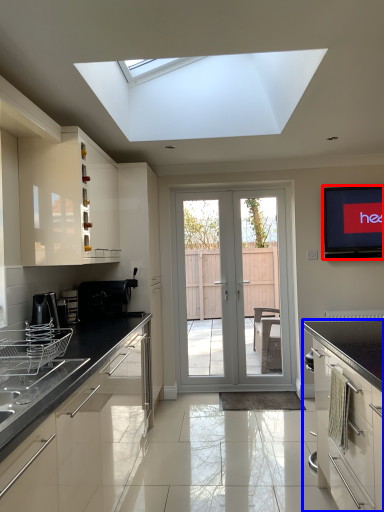
Question: Which of the following is the closest to the observer, electronic (highlighted by a red box) or cabinetry (highlighted by a blue box)?

Choices:
 (A) electronic
 (B) cabinetry

Answer: (B)